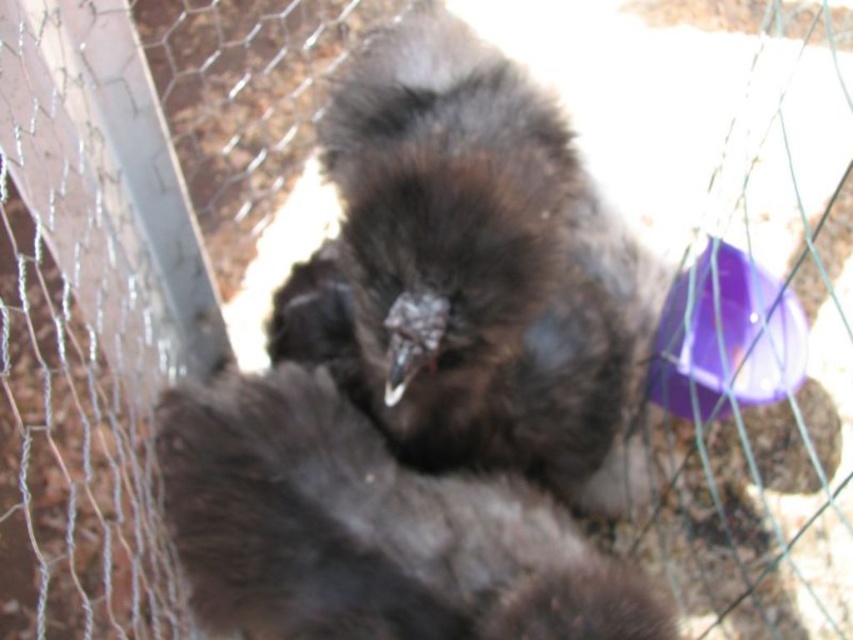
You are a farmer checking on your chickens. You see the dark brown fluffy bird at center and the dark brown feathers at center in the image. Which one is located higher up in the picture?

The dark brown fluffy bird at center is above the dark brown feathers at center, so the bird is higher up in the picture.

What is located at the coordinates point [469,269] in the image?

The point [469,269] indicates a dark brown fluffy bird at center.